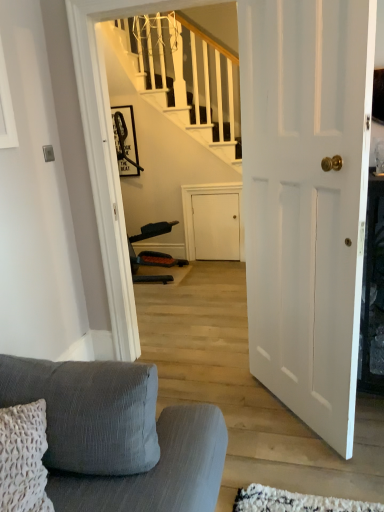
In order to click on free space to the left of white matte door at center in this screenshot , I will do `click(228, 406)`.